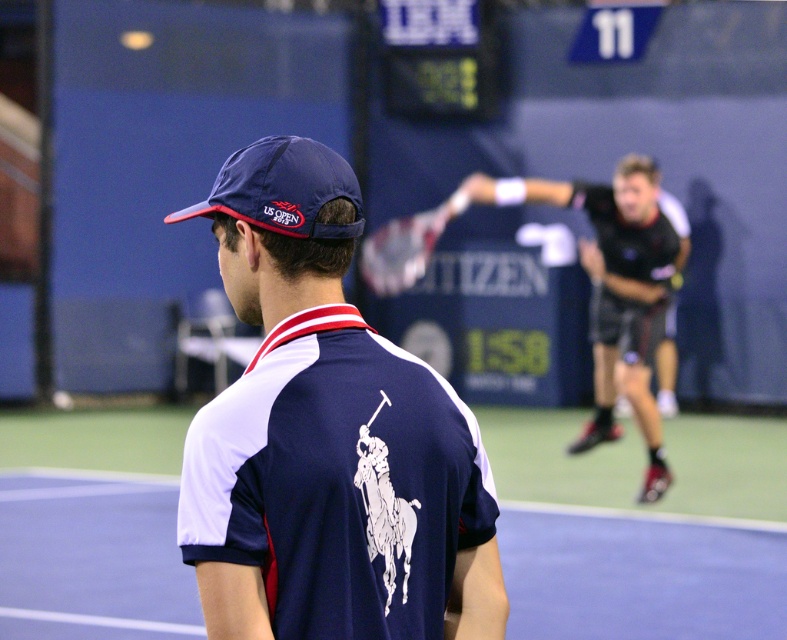
You are a photographer trying to capture a closeup shot of the navy blue fabric polo shirt at center and the white textured racket at center. Which object should you zoom in on more to ensure both fit in the frame?

The navy blue fabric polo shirt at center is thinner than the white textured racket at center, so you should zoom in more on the white textured racket at center to ensure both fit in the frame.

You are a photographer standing at the edge of the tennis court. You want to take a photo that includes both the navy blue fabric polo shirt at center and the white textured racket at center. Given their sizes, which object should you focus on first to ensure both are clearly visible in the frame?

The navy blue fabric polo shirt at center has a smaller size compared to the white textured racket at center. To ensure both are clearly visible, focus on the smaller navy blue fabric polo shirt at center first, then adjust the frame to include the larger white textured racket at center.

You are a spectator at the US Open 2018 tennis match. You notice the navy blue fabric polo shirt at center and the black synthetic tennis racket at upper right. Which object is located more to the left side?

The navy blue fabric polo shirt at center is positioned on the left side of the black synthetic tennis racket at upper right, so the navy blue fabric polo shirt at center is more to the left.